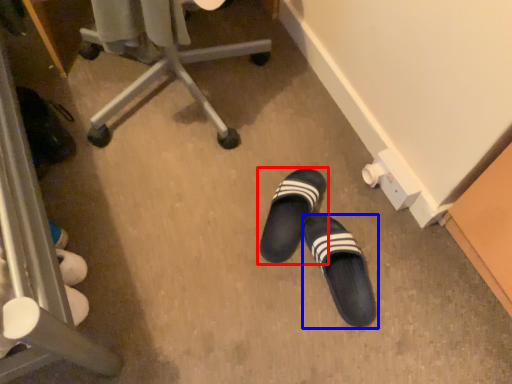
Question: Which object appears closest to the camera in this image, footwear (highlighted by a red box) or footwear (highlighted by a blue box)?

Choices:
 (A) footwear
 (B) footwear

Answer: (B)